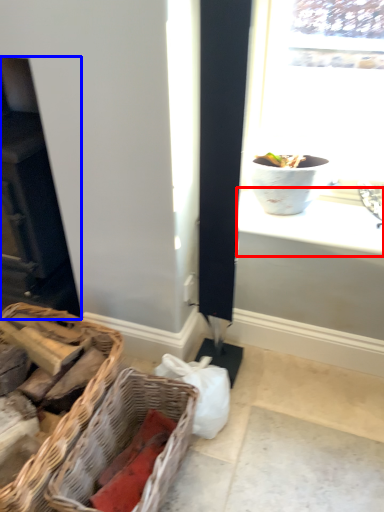
Question: Which point is closer to the camera, window sill (highlighted by a red box) or fireplace (highlighted by a blue box)?

Choices:
 (A) window sill
 (B) fireplace

Answer: (B)